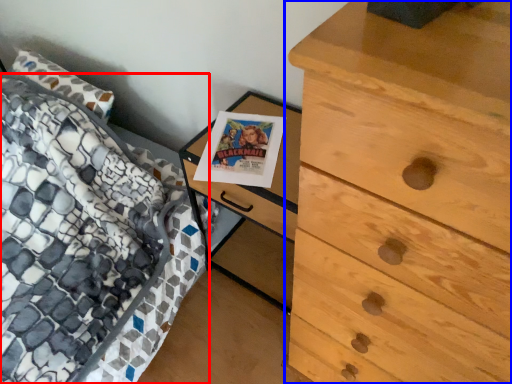
Question: Which point is further to the camera, bed (highlighted by a red box) or chest of drawers (highlighted by a blue box)?

Choices:
 (A) bed
 (B) chest of drawers

Answer: (A)